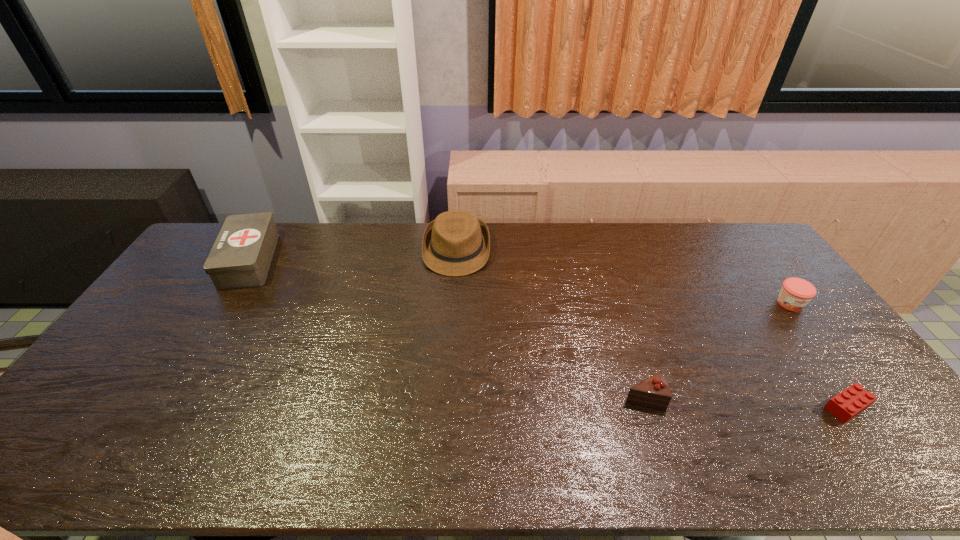
This screenshot has width=960, height=540. In order to click on fedora in this screenshot , I will do `click(456, 243)`.

You are a GUI agent. You are given a task and a screenshot of the screen. Output one action in this format:
    pyautogui.click(x=<x>, y=<y>)
    Task: Click on the leftmost object
    Image resolution: width=960 pixels, height=540 pixels.
    Given the screenshot: What is the action you would take?
    pyautogui.click(x=240, y=258)

Identify the location of the third nearest object. (x=795, y=294).

You are a GUI agent. You are given a task and a screenshot of the screen. Output one action in this format:
    pyautogui.click(x=<x>, y=<y>)
    Task: Click on the chocolate cake
    Image resolution: width=960 pixels, height=540 pixels.
    Given the screenshot: What is the action you would take?
    pyautogui.click(x=654, y=392)

Locate an element on the screen. The width and height of the screenshot is (960, 540). Lego is located at coordinates (847, 404).

Locate an element on the screen. Image resolution: width=960 pixels, height=540 pixels. free space located on the front-facing side of the fedora is located at coordinates (453, 308).

Locate an element on the screen. Image resolution: width=960 pixels, height=540 pixels. vacant space located on the front of the leftmost object is located at coordinates (183, 366).

Find the location of a particular element. This screenshot has width=960, height=540. free space located 0.300m on the front label of the third nearest object is located at coordinates (860, 397).

In order to click on free space located on the right of the chocolate cake in this screenshot , I will do `click(729, 398)`.

Locate an element on the screen. vacant space located 0.140m on the left of the shortest object is located at coordinates (768, 407).